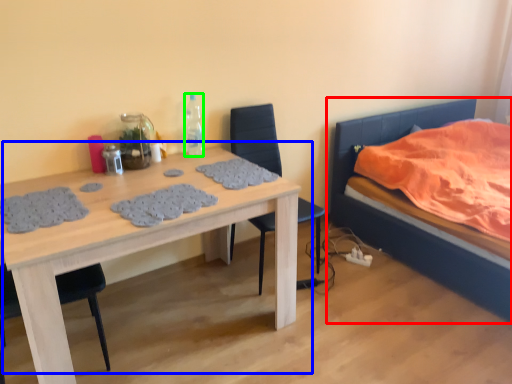
Question: Which object is the farthest from bed (highlighted by a red box)? Choose among these: table (highlighted by a blue box) or bottle (highlighted by a green box).

Choices:
 (A) table
 (B) bottle

Answer: (A)